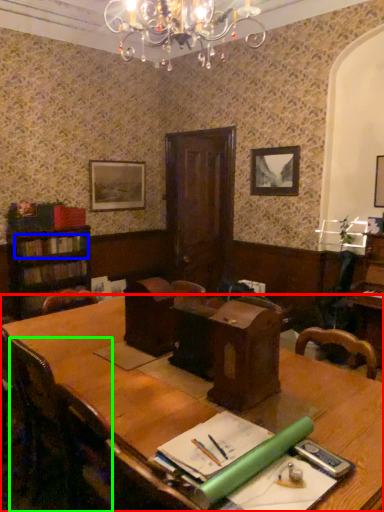
Question: Which object is the closest to the table (highlighted by a red box)? Choose among these: book (highlighted by a blue box) or chair (highlighted by a green box).

Choices:
 (A) book
 (B) chair

Answer: (B)